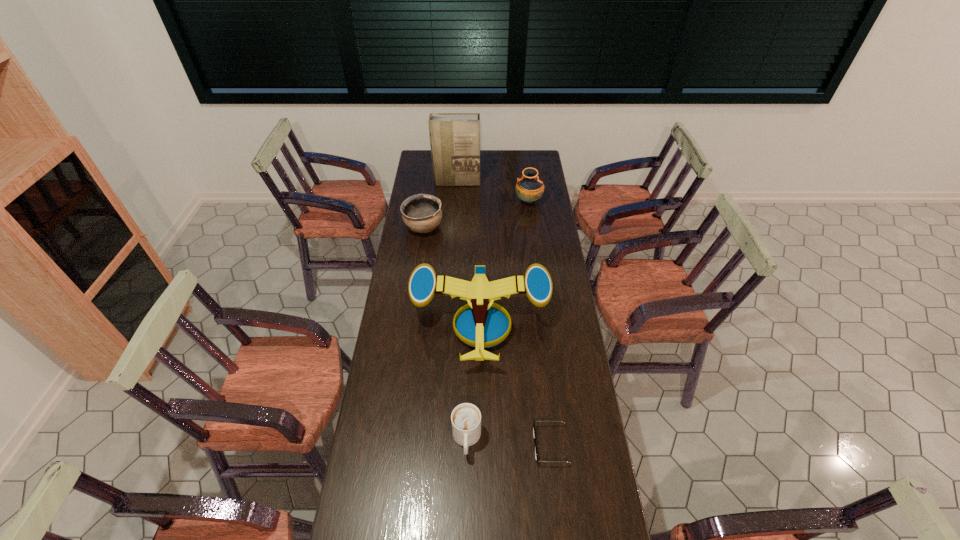
At what (x,y) coordinates should I click in order to perform the action: click on the farthest object. Please return your answer as a coordinate pair (x, y). The height and width of the screenshot is (540, 960). Looking at the image, I should click on (454, 137).

Find the location of a particular element. phonebook is located at coordinates (454, 137).

This screenshot has height=540, width=960. In order to click on the right pottery in this screenshot , I will do `click(529, 188)`.

Where is `the taller pottery`? This screenshot has height=540, width=960. the taller pottery is located at coordinates point(529,188).

The image size is (960, 540). What are the coordinates of `drone` in the screenshot? It's located at (481, 326).

Locate an element on the screen. the fourth nearest object is located at coordinates (421, 213).

I want to click on the left pottery, so click(x=421, y=213).

Identify the location of cappuccino. (466, 418).

This screenshot has width=960, height=540. I want to click on spectacles, so click(534, 434).

This screenshot has height=540, width=960. In order to click on free region located on the cover of the tallest object in this screenshot , I will do `click(456, 197)`.